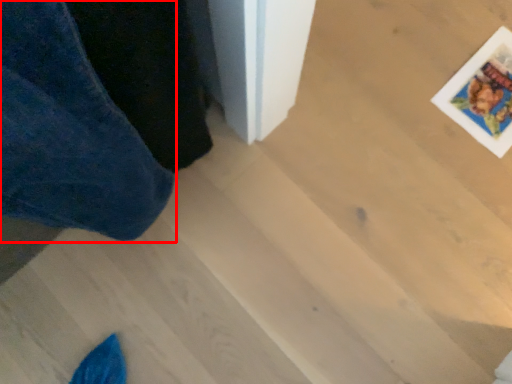
Question: From the image's perspective, where is trousers (annotated by the red box) located in relation to postcard in the image?

Choices:
 (A) above
 (B) below

Answer: (B)